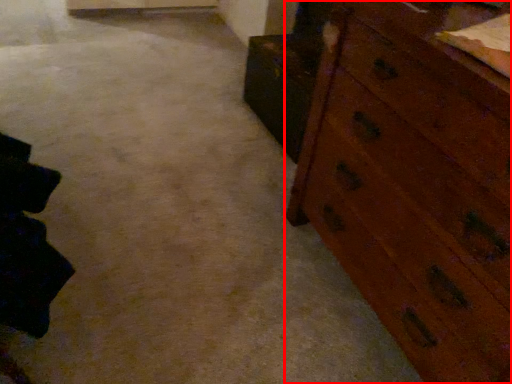
Question: Observing the image, what is the correct spatial positioning of chest of drawers (annotated by the red box) in reference to cabinetry?

Choices:
 (A) left
 (B) right

Answer: (B)